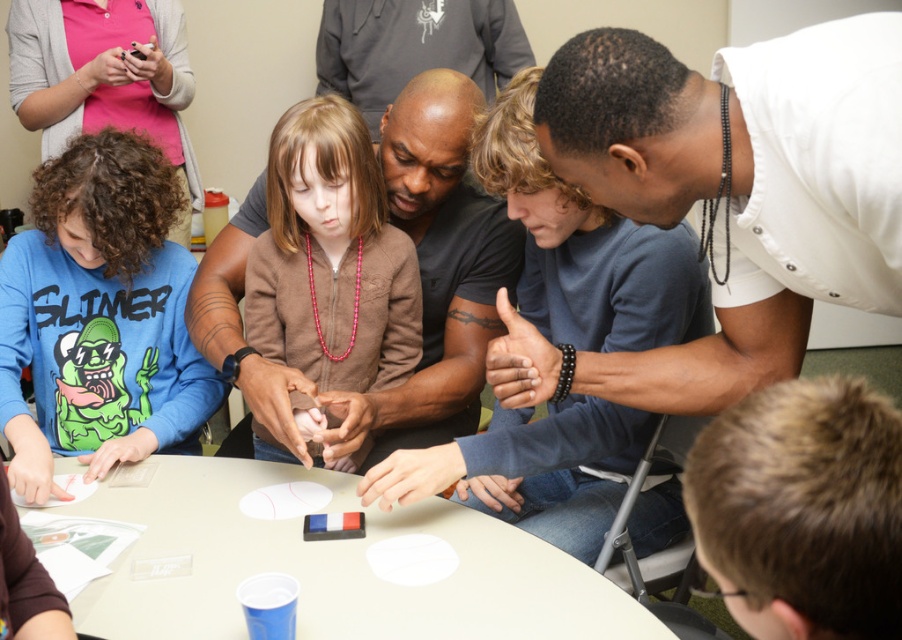
You are sitting at the edge of the room and want to pass a game piece to the person wearing the brown matte sweater at center. Which direction should you move towards relative to the white plastic table at center?

The white plastic table at center is to the left of the brown matte sweater at center. To reach the person wearing the brown matte sweater at center, you should move to the right of the white plastic table at center.

Based on the scene described, which object has a larger size between the blue cotton shirt at lower left and the brown matte sweater at center?

The blue cotton shirt at lower left has a larger size compared to the brown matte sweater at center.